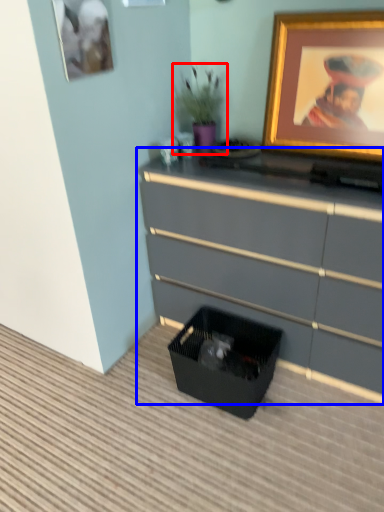
Question: Which object is further to the camera taking this photo, houseplant (highlighted by a red box) or chest of drawers (highlighted by a blue box)?

Choices:
 (A) houseplant
 (B) chest of drawers

Answer: (A)